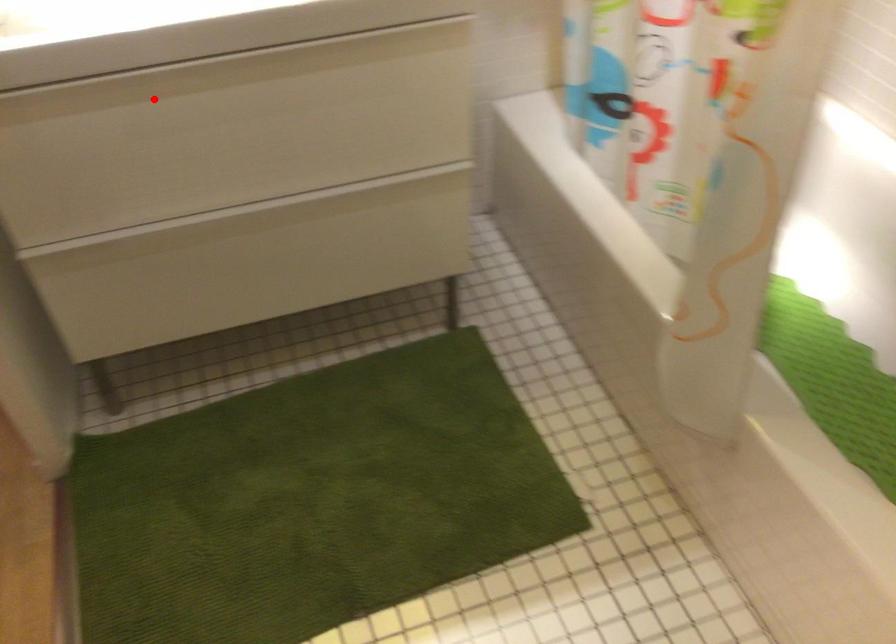
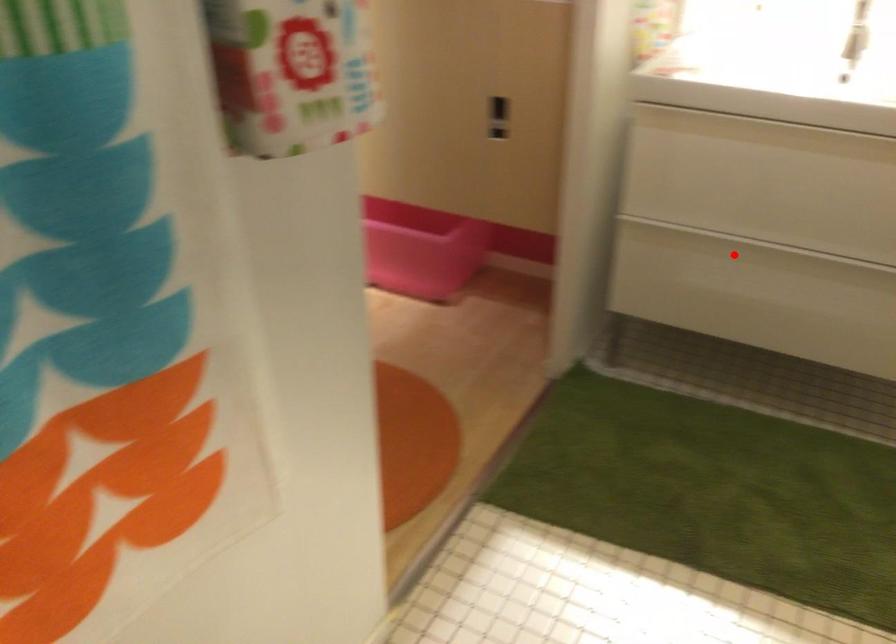
I am providing you with two images of the same scene from different viewpoints. A red point is marked on the first image and another point is marked on the second image. Is the red point in image1 aligned with the point shown in image2?

No